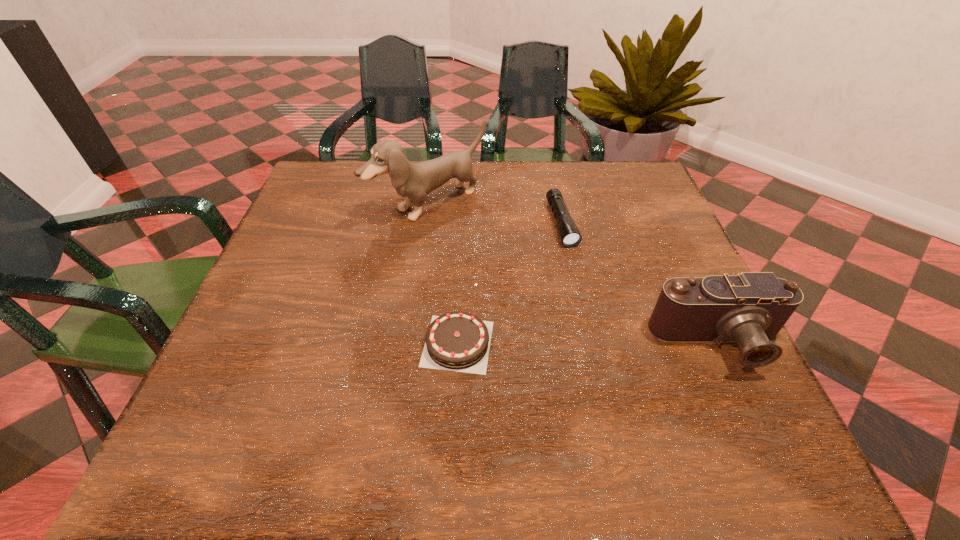
This screenshot has width=960, height=540. Find the location of `vacant space that's between the third object from left to right and the chocolate cake`. vacant space that's between the third object from left to right and the chocolate cake is located at coordinates (510, 284).

The width and height of the screenshot is (960, 540). I want to click on free space between the flashlight and the chocolate cake, so click(510, 284).

Find the location of a particular element. This screenshot has height=540, width=960. vacant point located between the chocolate cake and the tallest object is located at coordinates (444, 274).

Where is `empty space between the camera and the chocolate cake`? Image resolution: width=960 pixels, height=540 pixels. empty space between the camera and the chocolate cake is located at coordinates (588, 343).

Locate an element on the screen. vacant area that lies between the puppy and the second tallest object is located at coordinates (574, 274).

Locate an element on the screen. The height and width of the screenshot is (540, 960). empty space that is in between the flashlight and the chocolate cake is located at coordinates (510, 284).

This screenshot has height=540, width=960. Identify the location of the closest object to the third shortest object. (570, 236).

Locate an element on the screen. The image size is (960, 540). object that stands as the third closest to the chocolate cake is located at coordinates (750, 308).

The image size is (960, 540). What are the coordinates of `vacant space that satisfies the following two spatial constraints: 1. on the back side of the chocolate cake; 2. on the left side of the flashlight` in the screenshot? It's located at (463, 224).

Where is `vacant space that satisfies the following two spatial constraints: 1. on the front side of the flashlight; 2. on the right side of the puppy`? vacant space that satisfies the following two spatial constraints: 1. on the front side of the flashlight; 2. on the right side of the puppy is located at coordinates (427, 224).